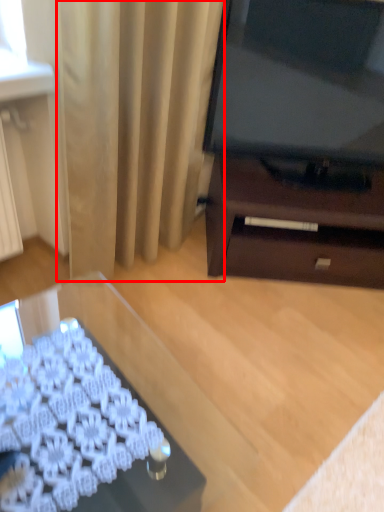
Question: Where is curtain (annotated by the red box) located in relation to desk in the image?

Choices:
 (A) left
 (B) right

Answer: (B)